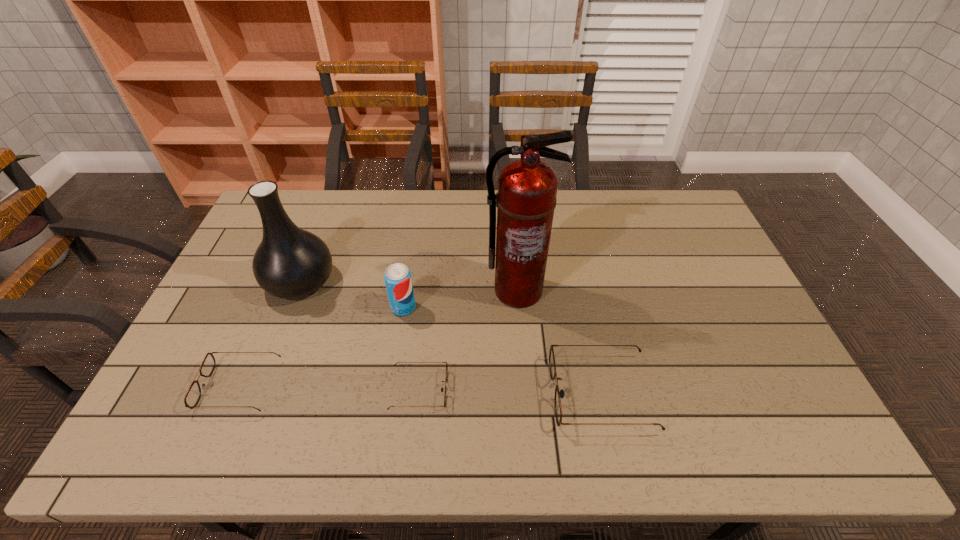
Find the location of a particular element. This screenshot has width=960, height=540. vacant region at the far edge of the desktop is located at coordinates (335, 196).

Where is `vacant space at the near edge of the desktop`? This screenshot has width=960, height=540. vacant space at the near edge of the desktop is located at coordinates (365, 402).

Where is `free space at the left edge of the desktop`? free space at the left edge of the desktop is located at coordinates (228, 323).

In the image, there is a desktop. At what (x,y) coordinates should I click in order to perform the action: click on vacant area at the right edge. Please return your answer as a coordinate pair (x, y). This screenshot has width=960, height=540. Looking at the image, I should click on (708, 330).

The image size is (960, 540). Identify the location of free region at the far left corner of the desktop. (288, 193).

This screenshot has height=540, width=960. I want to click on free space at the near left corner, so click(186, 383).

The image size is (960, 540). Identify the location of free region at the far right corner. (675, 192).

This screenshot has height=540, width=960. I want to click on vacant space in between the third tallest object and the fifth shortest object, so click(352, 294).

You are a GUI agent. You are given a task and a screenshot of the screen. Output one action in this format:
    pyautogui.click(x=<x>, y=<y>)
    Task: Click on the free spot between the shortest sunglasses and the second shortest sunglasses
    The height and width of the screenshot is (540, 960).
    Given the screenshot: What is the action you would take?
    pyautogui.click(x=329, y=388)

This screenshot has width=960, height=540. I want to click on free space between the tallest object and the third tallest object, so click(x=461, y=299).